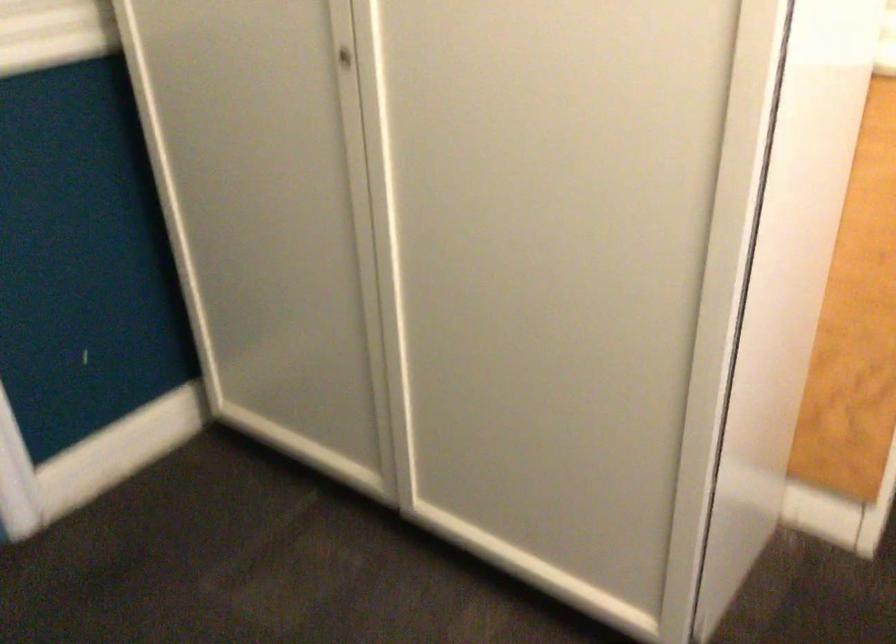
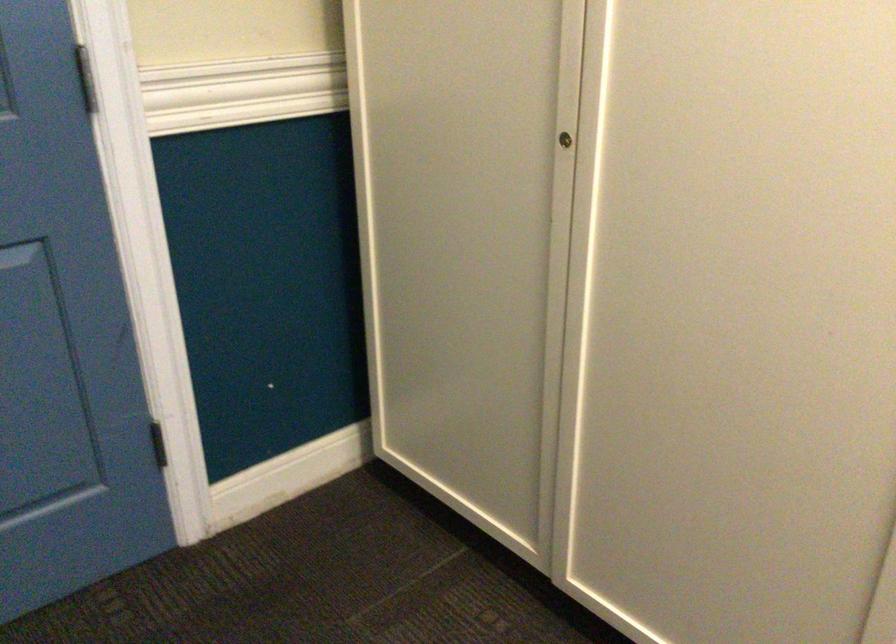
Locate, in the second image, the point that corresponds to pixel 358 71 in the first image.

(566, 137)